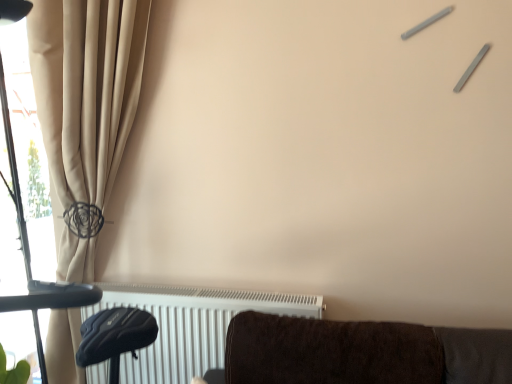
You are a GUI agent. You are given a task and a screenshot of the screen. Output one action in this format:
    pyautogui.click(x=<x>, y=<y>)
    Task: Click on the beige fabric curtain at left
    This screenshot has height=384, width=512.
    Given the screenshot: What is the action you would take?
    pyautogui.click(x=86, y=89)

What is the approximate width of beige fabric curtain at left?

The width of beige fabric curtain at left is 8.10 inches.

Describe the element at coordinates (86, 89) in the screenshot. The image size is (512, 384). I see `beige fabric curtain at left` at that location.

In order to face white metallic radiator at lower center, should I rotate leftwards or rightwards?

Rotate your view left by about 7.194°.

Image resolution: width=512 pixels, height=384 pixels. In order to click on white metallic radiator at lower center in this screenshot , I will do `click(191, 325)`.

What do you see at coordinates (191, 325) in the screenshot?
I see `white metallic radiator at lower center` at bounding box center [191, 325].

At what (x,y) coordinates should I click in order to perform the action: click on beige fabric curtain at left. Please return your answer as a coordinate pair (x, y). Image resolution: width=512 pixels, height=384 pixels. Looking at the image, I should click on (86, 89).

Which is more to the left, white metallic radiator at lower center or beige fabric curtain at left?

beige fabric curtain at left is more to the left.

Is the depth of white metallic radiator at lower center less than that of beige fabric curtain at left?

No, it is behind beige fabric curtain at left.

Is point (142, 358) behind point (114, 20)?

Yes, point (142, 358) is behind point (114, 20).

From the image's perspective, is white metallic radiator at lower center below beige fabric curtain at left?

Indeed, from the image's perspective, white metallic radiator at lower center is shown beneath beige fabric curtain at left.

From a real-world perspective, which object rests below the other?

From a 3D spatial view, white metallic radiator at lower center is below.

Which object is thinner, white metallic radiator at lower center or beige fabric curtain at left?

white metallic radiator at lower center is thinner.

Is white metallic radiator at lower center taller than beige fabric curtain at left?

In fact, white metallic radiator at lower center may be shorter than beige fabric curtain at left.

Considering the relative sizes of white metallic radiator at lower center and beige fabric curtain at left in the image provided, is white metallic radiator at lower center bigger than beige fabric curtain at left?

Incorrect, white metallic radiator at lower center is not larger than beige fabric curtain at left.

Is beige fabric curtain at left located within white metallic radiator at lower center?

Definitely not — beige fabric curtain at left is not inside white metallic radiator at lower center.

Is the surface of white metallic radiator at lower center in direct contact with beige fabric curtain at left?

white metallic radiator at lower center is not next to beige fabric curtain at left, and they're not touching.

Is white metallic radiator at lower center facing away from beige fabric curtain at left?

Absolutely, white metallic radiator at lower center is directed away from beige fabric curtain at left.

Measure the distance between white metallic radiator at lower center and beige fabric curtain at left.

white metallic radiator at lower center is 22.33 inches from beige fabric curtain at left.

The width and height of the screenshot is (512, 384). I want to click on radiator behind the beige fabric curtain at left, so click(191, 325).

Considering the relative positions of beige fabric curtain at left and white metallic radiator at lower center in the image provided, is beige fabric curtain at left to the left of white metallic radiator at lower center from the viewer's perspective?

Yes, beige fabric curtain at left is to the left of white metallic radiator at lower center.

Is beige fabric curtain at left closer to the viewer compared to white metallic radiator at lower center?

Yes, it is in front of white metallic radiator at lower center.

Considering the points (73, 46) and (144, 365), which point is in front, point (73, 46) or point (144, 365)?

The point (73, 46) is in front.

From the image's perspective, which one is positioned lower, beige fabric curtain at left or white metallic radiator at lower center?

From the image's view, white metallic radiator at lower center is below.

Looking at this image, from a real-world perspective, who is located higher, beige fabric curtain at left or white metallic radiator at lower center?

beige fabric curtain at left is physically above.

Considering the sizes of beige fabric curtain at left and white metallic radiator at lower center in the image, is beige fabric curtain at left wider or thinner than white metallic radiator at lower center?

beige fabric curtain at left is wider than white metallic radiator at lower center.

Who is taller, beige fabric curtain at left or white metallic radiator at lower center?

With more height is beige fabric curtain at left.

Considering the relative sizes of beige fabric curtain at left and white metallic radiator at lower center in the image provided, is beige fabric curtain at left bigger than white metallic radiator at lower center?

Indeed, beige fabric curtain at left has a larger size compared to white metallic radiator at lower center.

Is white metallic radiator at lower center completely or partially inside beige fabric curtain at left?

Yes, white metallic radiator at lower center is inside beige fabric curtain at left.

Is beige fabric curtain at left not close to white metallic radiator at lower center?

They are positioned close to each other.

Does beige fabric curtain at left turn towards white metallic radiator at lower center?

Yes, beige fabric curtain at left is aimed at white metallic radiator at lower center.

Where is `radiator directly beneath the beige fabric curtain at left (from a real-world perspective)`? radiator directly beneath the beige fabric curtain at left (from a real-world perspective) is located at coordinates (191, 325).

Locate an element on the screen. radiator lying below the beige fabric curtain at left (from the image's perspective) is located at coordinates (191, 325).

This screenshot has width=512, height=384. Identify the location of curtain that appears in front of the white metallic radiator at lower center. (86, 89).